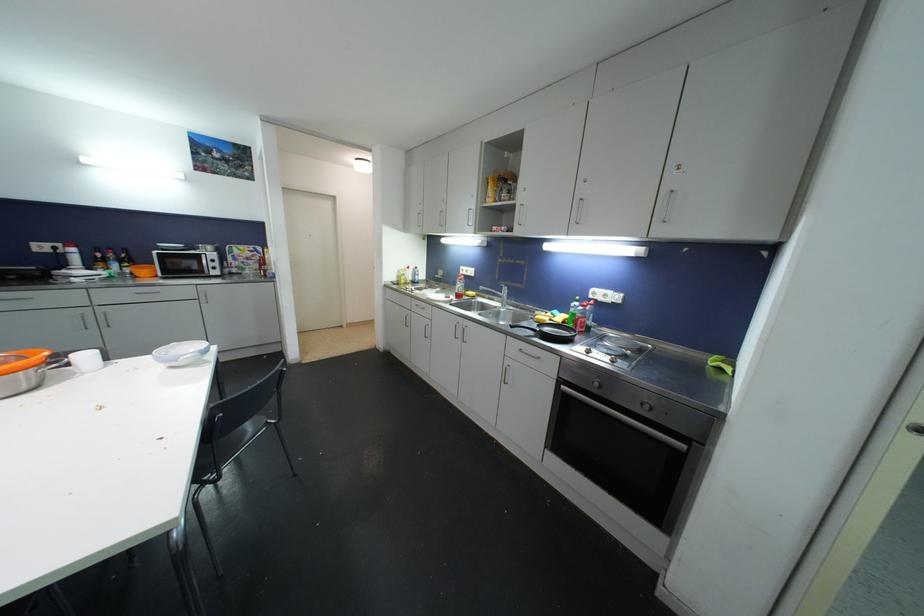
Where would you lift the orange pot handle? Please return your answer as a coordinate pair (x, y).

(21, 360)